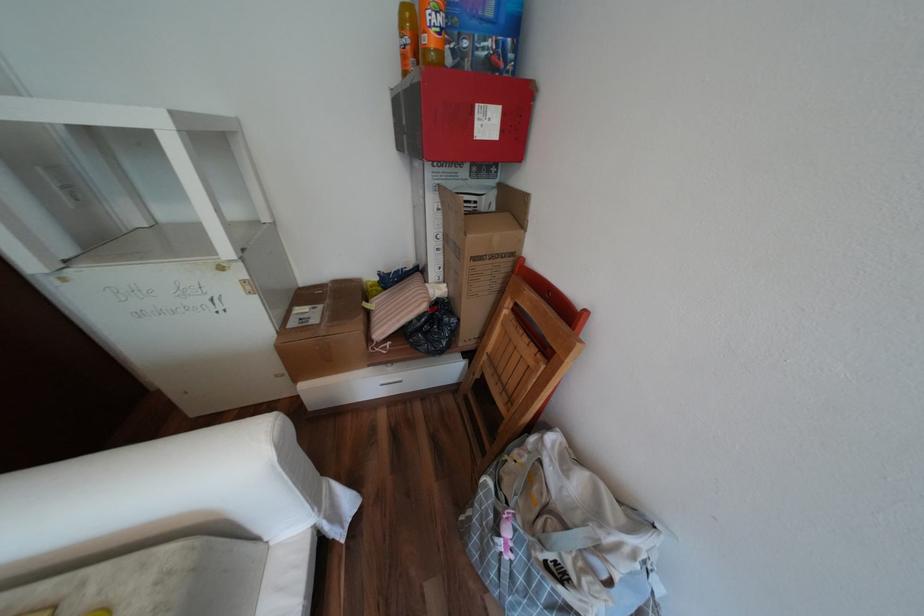
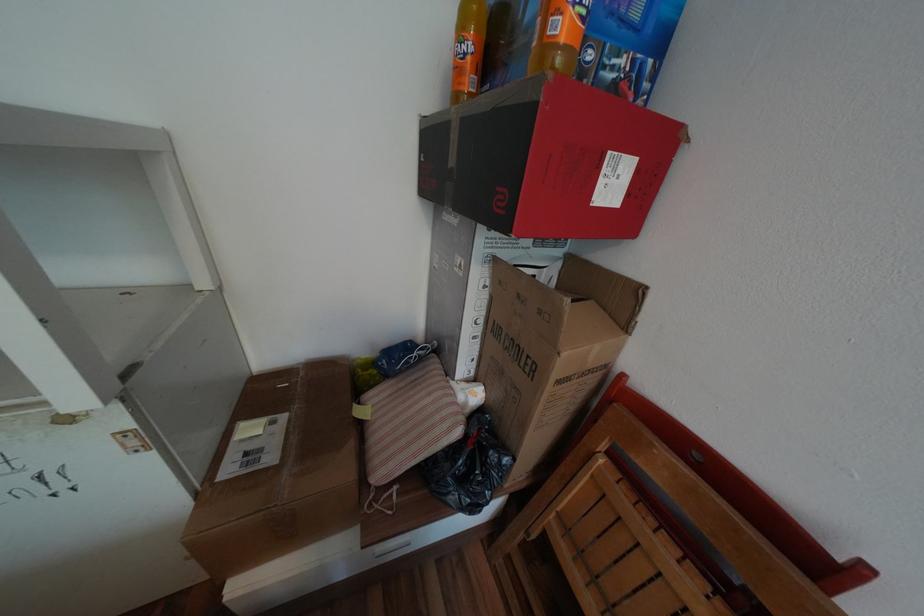
What movement of the cameraman would produce the second image?

The cameraman moved toward left, forward.